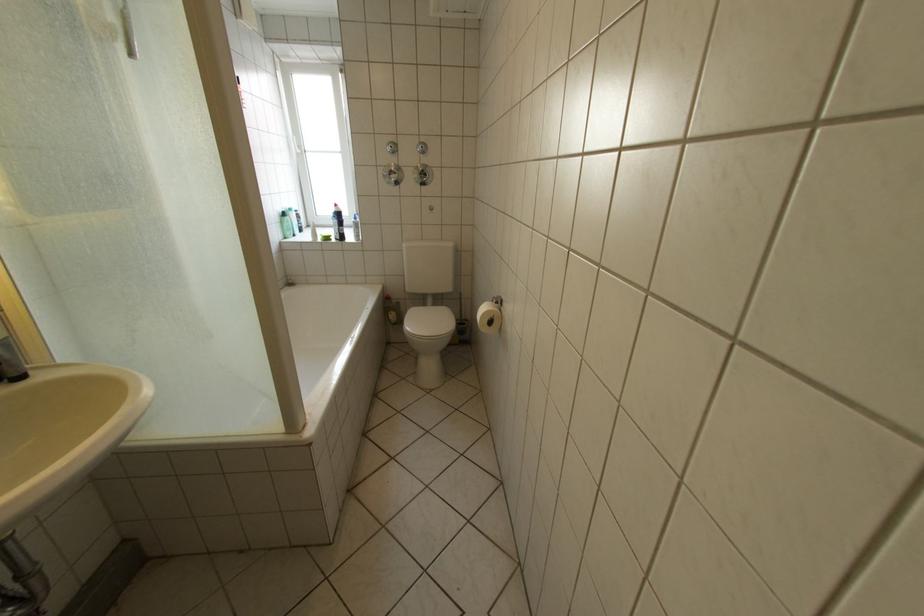
What do you see at coordinates (429, 321) in the screenshot? I see `a white toilet lid` at bounding box center [429, 321].